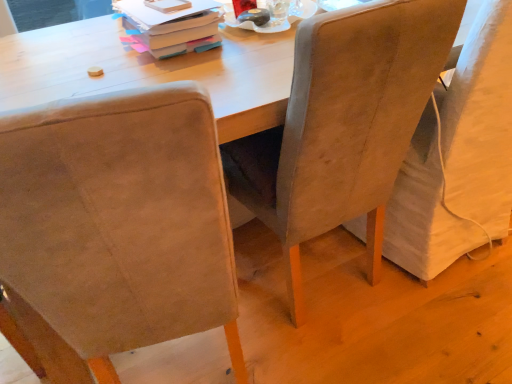
Find the location of a particular element. The width and height of the screenshot is (512, 384). vacant area that lies between suede-like beige chair at center, which is the second chair from right to left, and suede-like beige chair at right, which ranks as the third chair in left-to-right order is located at coordinates (385, 295).